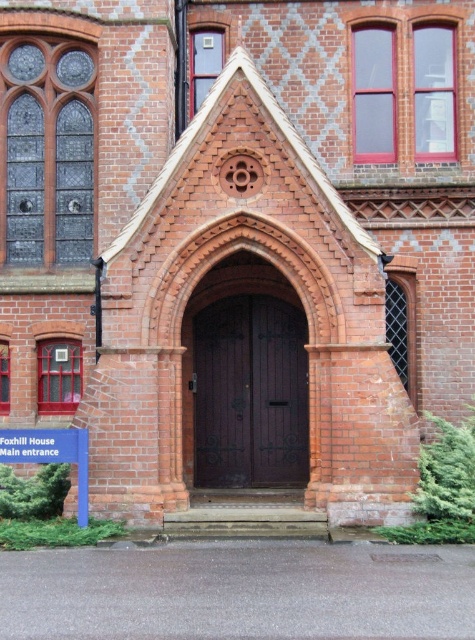
You are standing in front of Foxhill House and need to locate the dark wood door at center. According to the coordinates provided, where exactly should you look to find it?

The dark wood door at center is located at the 2D coordinates point (249, 394).